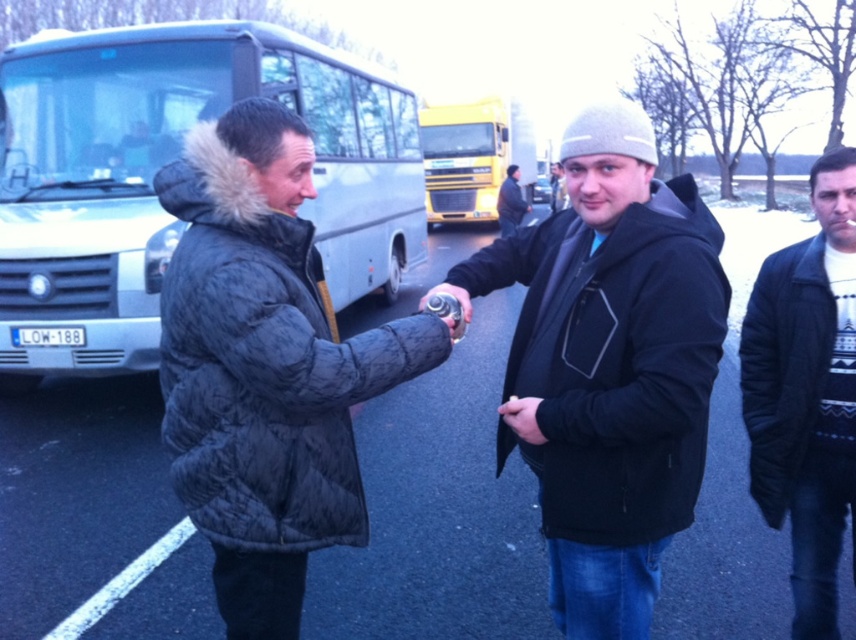
Question: Does black quilted jacket at center appear under black fleece jacket at center?

Choices:
 (A) yes
 (B) no

Answer: (A)

Question: Is quilted dark gray jacket at center thinner than dark blue textured coat at right?

Choices:
 (A) yes
 (B) no

Answer: (B)

Question: Which object is closer to the camera taking this photo?

Choices:
 (A) silver metallic bus at left
 (B) dark gray knit hat at center
 (C) dark gray knit cap at center

Answer: (A)

Question: Does black fleece jacket at center appear on the right side of yellow matte truck at upper center?

Choices:
 (A) yes
 (B) no

Answer: (A)

Question: Which object appears closest to the camera in this image?

Choices:
 (A) dark gray knit hat at center
 (B) dark blue textured coat at right

Answer: (B)

Question: Which point is farther to the camera?

Choices:
 (A) dark gray knit cap at center
 (B) silver metallic bus at left
 (C) dark gray knit hat at center

Answer: (A)